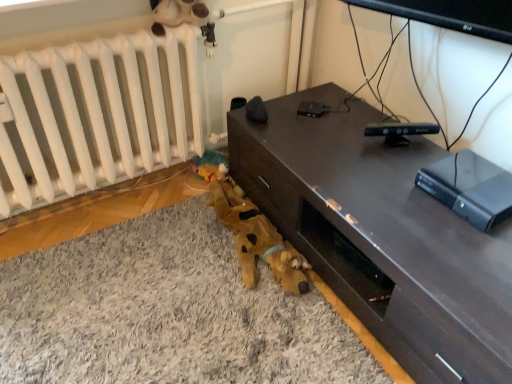
Find the location of a particular element. vacant space that's between black plastic gaming console at right and black plastic remote control at upper center, arranged as the 2th gadget when viewed from the left is located at coordinates (411, 159).